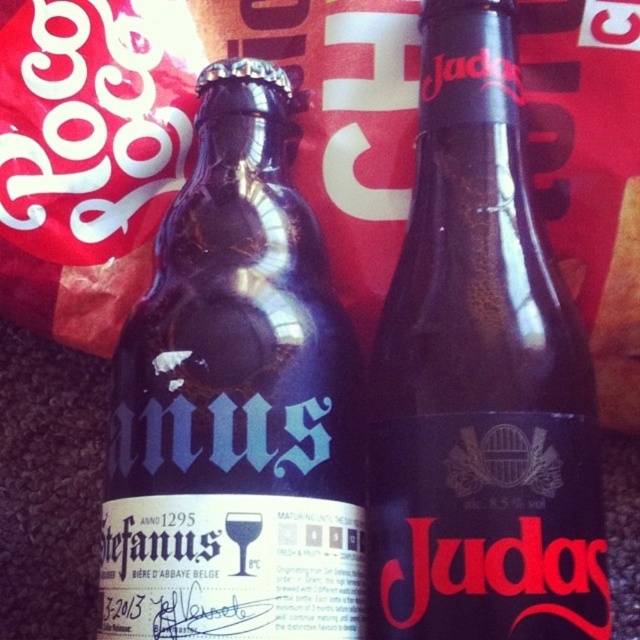
Question: Is blue glass bottle at left positioned at the back of dark glass bottle at center?

Choices:
 (A) yes
 (B) no

Answer: (B)

Question: Can you confirm if blue glass bottle at left is positioned to the left of dark glass bottle at center?

Choices:
 (A) no
 (B) yes

Answer: (B)

Question: Which point is farther to the camera?

Choices:
 (A) dark glass bottle at center
 (B) blue glass bottle at left

Answer: (A)

Question: Does blue glass bottle at left have a greater width compared to dark glass bottle at center?

Choices:
 (A) no
 (B) yes

Answer: (B)

Question: Which point is closer to the camera?

Choices:
 (A) dark glass bottle at center
 (B) blue glass bottle at left

Answer: (B)

Question: Among these objects, which one is farthest from the camera?

Choices:
 (A) dark glass bottle at center
 (B) blue glass bottle at left

Answer: (A)